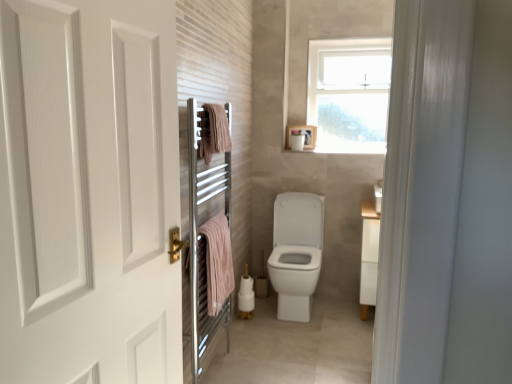
Describe the element at coordinates (297, 142) in the screenshot. I see `white matte toilet paper at upper center` at that location.

What is the approximate width of chrome metallic towel warmer at left?

It is 6.98 centimeters.

This screenshot has height=384, width=512. What do you see at coordinates (202, 224) in the screenshot?
I see `chrome metallic towel warmer at left` at bounding box center [202, 224].

The image size is (512, 384). In order to click on white matte door at left in this screenshot , I will do `click(88, 192)`.

Looking at this image, from the image's perspective, relative to pink cotton towel at left, acting as the 2th bath towel starting from the top, is white matte toilet paper at upper center above or below?

white matte toilet paper at upper center is situated higher than pink cotton towel at left, acting as the 2th bath towel starting from the top, in the image.

Is white matte toilet paper at upper center far away from pink cotton towel at left, acting as the 2th bath towel starting from the top?

→ Yes, white matte toilet paper at upper center is far from pink cotton towel at left, acting as the 2th bath towel starting from the top.

Is white matte toilet paper at upper center bigger than pink cotton towel at left, which is the first bath towel in bottom-to-top order?

No.

Choose the correct answer: Is white matte toilet paper at upper center inside pink cotton towel at left, acting as the 2th bath towel starting from the top, or outside it?

white matte toilet paper at upper center exists outside the volume of pink cotton towel at left, acting as the 2th bath towel starting from the top.

Is the position of pink cotton towel at upper center, positioned as the 2th bath towel in bottom-to-top order, more distant than that of white matte door at left?

Yes.

At what (x,y) coordinates should I click in order to perform the action: click on the 2nd bath towel counting from the right of the white matte door at left. Please return your answer as a coordinate pair (x, y). Looking at the image, I should click on (214, 132).

Considering the positions of point (227, 119) and point (51, 134), is point (227, 119) closer or farther from the camera than point (51, 134)?

Point (227, 119) is farther from the camera than point (51, 134).

Is white matte door at left surrounded by pink cotton towel at upper center, the first bath towel in the top-to-bottom sequence?

That's incorrect, white matte door at left is not inside pink cotton towel at upper center, the first bath towel in the top-to-bottom sequence.

From the image's perspective, would you say pink cotton towel at upper center, the first bath towel in the top-to-bottom sequence, is shown under chrome metallic towel warmer at left?

No, from the image's perspective, pink cotton towel at upper center, the first bath towel in the top-to-bottom sequence, is not beneath chrome metallic towel warmer at left.

Which object is more forward, pink cotton towel at upper center, positioned as the 2th bath towel in bottom-to-top order, or chrome metallic towel warmer at left?

chrome metallic towel warmer at left.

In the image, there is a pink cotton towel at upper center, positioned as the 2th bath towel in bottom-to-top order. What are the coordinates of `screen door below it (from a real-world perspective)` in the screenshot? It's located at (202, 224).

Is pink cotton towel at upper center, the first bath towel in the top-to-bottom sequence, inside or outside of chrome metallic towel warmer at left?

pink cotton towel at upper center, the first bath towel in the top-to-bottom sequence, is enclosed within chrome metallic towel warmer at left.

In the scene shown: Considering the positions of objects pink cotton towel at left, which is the first bath towel in bottom-to-top order, and pink cotton towel at upper center, positioned as the 2th bath towel in bottom-to-top order, in the image provided, who is more to the right, pink cotton towel at left, which is the first bath towel in bottom-to-top order, or pink cotton towel at upper center, positioned as the 2th bath towel in bottom-to-top order,?

pink cotton towel at upper center, positioned as the 2th bath towel in bottom-to-top order, is more to the right.

Is pink cotton towel at left, acting as the 2th bath towel starting from the top, smaller than pink cotton towel at upper center, the first bath towel in the top-to-bottom sequence?

Incorrect, pink cotton towel at left, acting as the 2th bath towel starting from the top, is not smaller in size than pink cotton towel at upper center, the first bath towel in the top-to-bottom sequence.

Choose the correct answer: Is pink cotton towel at left, which is the first bath towel in bottom-to-top order, inside pink cotton towel at upper center, the first bath towel in the top-to-bottom sequence, or outside it?

pink cotton towel at left, which is the first bath towel in bottom-to-top order, is spatially situated outside pink cotton towel at upper center, the first bath towel in the top-to-bottom sequence.

I want to click on bath towel located above the pink cotton towel at left, acting as the 2th bath towel starting from the top (from the image's perspective), so click(x=214, y=132).

Measure the distance from pink cotton towel at left, which is the first bath towel in bottom-to-top order, to white matte toilet paper at upper center.

pink cotton towel at left, which is the first bath towel in bottom-to-top order, is 4.37 feet away from white matte toilet paper at upper center.

How different are the orientations of pink cotton towel at left, acting as the 2th bath towel starting from the top, and white matte toilet paper at upper center in degrees?

87.1 degrees.

Considering the sizes of objects pink cotton towel at left, which is the first bath towel in bottom-to-top order, and white matte toilet paper at upper center in the image provided, who is wider, pink cotton towel at left, which is the first bath towel in bottom-to-top order, or white matte toilet paper at upper center?

With larger width is white matte toilet paper at upper center.

Between pink cotton towel at left, which is the first bath towel in bottom-to-top order, and white matte toilet paper at upper center, which one has less height?

white matte toilet paper at upper center.

From a real-world perspective, is chrome metallic towel warmer at left on pink cotton towel at upper center, the first bath towel in the top-to-bottom sequence?

No.

Can pink cotton towel at upper center, positioned as the 2th bath towel in bottom-to-top order, be found inside chrome metallic towel warmer at left?

Indeed, pink cotton towel at upper center, positioned as the 2th bath towel in bottom-to-top order, is located within chrome metallic towel warmer at left.

Where is `screen door on the left of pink cotton towel at upper center, the first bath towel in the top-to-bottom sequence`? This screenshot has height=384, width=512. screen door on the left of pink cotton towel at upper center, the first bath towel in the top-to-bottom sequence is located at coordinates tap(202, 224).

Is chrome metallic towel warmer at left oriented away from pink cotton towel at upper center, the first bath towel in the top-to-bottom sequence?

Yes, pink cotton towel at upper center, the first bath towel in the top-to-bottom sequence, is at the back of chrome metallic towel warmer at left.

Is white matte door at left taller than pink cotton towel at left, which is the first bath towel in bottom-to-top order?

Yes.

Consider the image. From a real-world perspective, is white matte door at left over pink cotton towel at left, which is the first bath towel in bottom-to-top order?

Yes, from a real-world perspective, white matte door at left is above pink cotton towel at left, which is the first bath towel in bottom-to-top order.

Does white matte door at left have a smaller size compared to pink cotton towel at left, which is the first bath towel in bottom-to-top order?

Actually, white matte door at left might be larger than pink cotton towel at left, which is the first bath towel in bottom-to-top order.

Is pink cotton towel at left, acting as the 2th bath towel starting from the top, inside white matte door at left?

Definitely not — pink cotton towel at left, acting as the 2th bath towel starting from the top, is not inside white matte door at left.

Where is `toilet paper on the right of pink cotton towel at left, which is the first bath towel in bottom-to-top order`? This screenshot has width=512, height=384. toilet paper on the right of pink cotton towel at left, which is the first bath towel in bottom-to-top order is located at coordinates (297, 142).

In the image, there is a pink cotton towel at upper center, the first bath towel in the top-to-bottom sequence. At what (x,y) coordinates should I click in order to perform the action: click on door below it (from a real-world perspective). Please return your answer as a coordinate pair (x, y). This screenshot has height=384, width=512. Looking at the image, I should click on (88, 192).

In the scene shown: When comparing their distances from white matte toilet paper at upper center, does pink cotton towel at left, which is the first bath towel in bottom-to-top order, or pink cotton towel at upper center, positioned as the 2th bath towel in bottom-to-top order, seem closer?

pink cotton towel at upper center, positioned as the 2th bath towel in bottom-to-top order, lies closer to white matte toilet paper at upper center than the other object.

Considering their positions, is pink cotton towel at upper center, the first bath towel in the top-to-bottom sequence, positioned closer to white matte toilet paper at upper center than chrome metallic towel warmer at left?

The object closer to white matte toilet paper at upper center is pink cotton towel at upper center, the first bath towel in the top-to-bottom sequence.

Considering their positions, is chrome metallic towel warmer at left positioned closer to pink cotton towel at upper center, the first bath towel in the top-to-bottom sequence, than pink cotton towel at left, which is the first bath towel in bottom-to-top order?

chrome metallic towel warmer at left is positioned closer to the anchor pink cotton towel at upper center, the first bath towel in the top-to-bottom sequence.

Looking at the image, which one is located closer to pink cotton towel at left, acting as the 2th bath towel starting from the top, white matte toilet paper at upper center or chrome metallic towel warmer at left?

chrome metallic towel warmer at left is closer to pink cotton towel at left, acting as the 2th bath towel starting from the top.

When comparing their distances from white matte door at left, does chrome metallic towel warmer at left or pink cotton towel at upper center, positioned as the 2th bath towel in bottom-to-top order, seem closer?

chrome metallic towel warmer at left.

From the image, which object appears to be nearer to white matte toilet paper at upper center, pink cotton towel at left, which is the first bath towel in bottom-to-top order, or chrome metallic towel warmer at left?

chrome metallic towel warmer at left lies closer to white matte toilet paper at upper center than the other object.

Based on their spatial positions, is chrome metallic towel warmer at left or pink cotton towel at left, which is the first bath towel in bottom-to-top order, further from white matte toilet paper at upper center?

pink cotton towel at left, which is the first bath towel in bottom-to-top order, lies further to white matte toilet paper at upper center than the other object.

Estimate the real-world distances between objects in this image. Which object is closer to white matte toilet paper at upper center, pink cotton towel at upper center, positioned as the 2th bath towel in bottom-to-top order, or white matte door at left?

Among the two, pink cotton towel at upper center, positioned as the 2th bath towel in bottom-to-top order, is located nearer to white matte toilet paper at upper center.

At what (x,y) coordinates should I click in order to perform the action: click on screen door between pink cotton towel at upper center, positioned as the 2th bath towel in bottom-to-top order, and pink cotton towel at left, which is the first bath towel in bottom-to-top order, from top to bottom. Please return your answer as a coordinate pair (x, y). Image resolution: width=512 pixels, height=384 pixels. Looking at the image, I should click on (202, 224).

I want to click on screen door between white matte door at left and pink cotton towel at upper center, positioned as the 2th bath towel in bottom-to-top order, in the front-back direction, so click(x=202, y=224).

Locate an element on the screen. This screenshot has height=384, width=512. bath towel located between pink cotton towel at upper center, positioned as the 2th bath towel in bottom-to-top order, and white matte toilet paper at upper center in the depth direction is located at coordinates (218, 262).

At what (x,y) coordinates should I click in order to perform the action: click on screen door located between white matte door at left and white matte toilet paper at upper center in the depth direction. Please return your answer as a coordinate pair (x, y). Looking at the image, I should click on (202, 224).